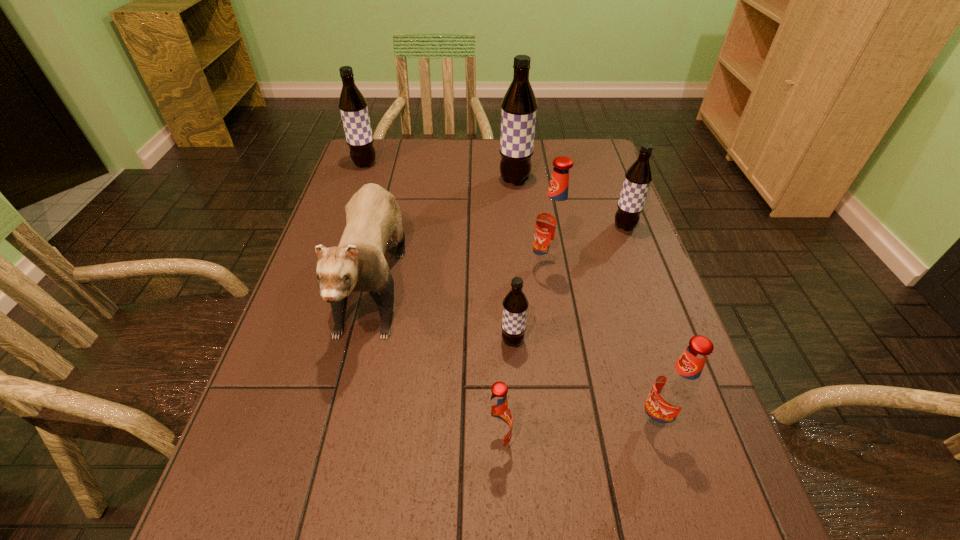
In order to click on the seventh object from left to right in this screenshot , I will do `click(675, 391)`.

I want to click on the sixth root beer from left to right, so click(675, 391).

Identify the location of the third nearest root beer. (515, 304).

Locate an element on the screen. The image size is (960, 540). the nearest brown root beer is located at coordinates (515, 304).

Where is `the smallest red root beer`? the smallest red root beer is located at coordinates (498, 418).

You are a GUI agent. You are given a task and a screenshot of the screen. Output one action in this format:
    pyautogui.click(x=<x>, y=<y>)
    Task: Click on the vacant space situated on the front of the tallest root beer
    This screenshot has width=960, height=540.
    Given the screenshot: What is the action you would take?
    pyautogui.click(x=518, y=214)

Locate an element on the screen. Image resolution: width=960 pixels, height=540 pixels. vacant area located 0.330m on the front of the farthest brown root beer is located at coordinates (339, 239).

Image resolution: width=960 pixels, height=540 pixels. What are the coordinates of `vacant space located 0.390m on the front of the second red root beer from left to right` in the screenshot? It's located at (574, 440).

Identify the location of vacant region located on the face of the gray ferret. (x=319, y=513).

Identify the location of vacant space located on the left of the third farthest brown root beer. (542, 226).